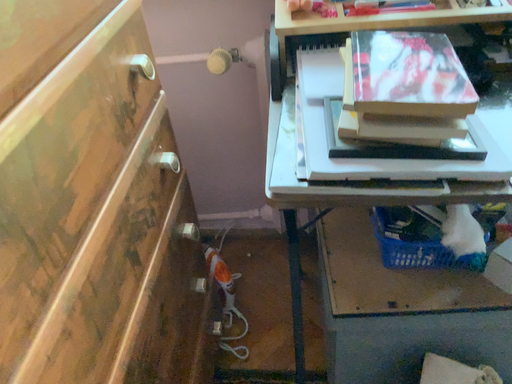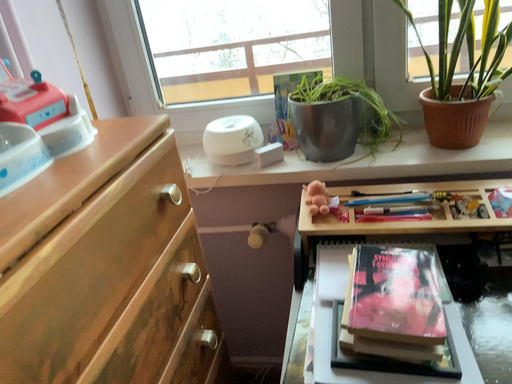
Question: How did the camera likely rotate when shooting the video?

Choices:
 (A) rotated downward
 (B) rotated upward

Answer: (B)